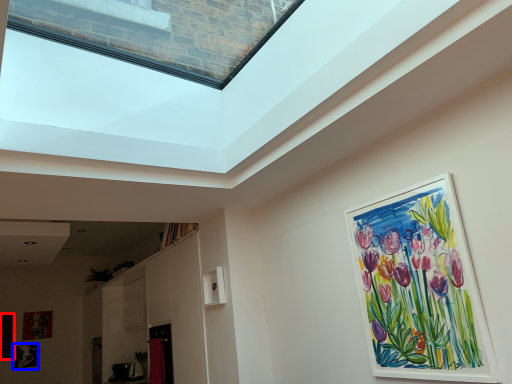
Question: Which object is closer to the camera taking this photo, picture frame (highlighted by a red box) or picture frame (highlighted by a blue box)?

Choices:
 (A) picture frame
 (B) picture frame

Answer: (A)